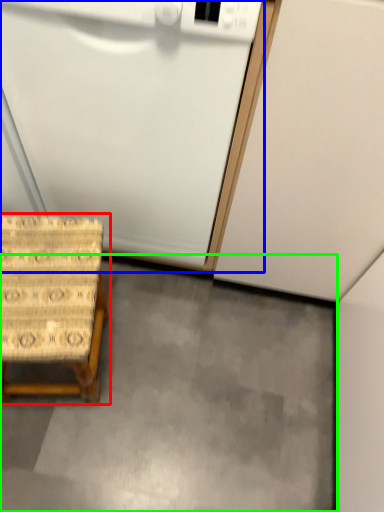
Question: Considering the real-world distances, which object is closest to furniture (highlighted by a red box)? appliance (highlighted by a blue box) or concrete (highlighted by a green box).

Choices:
 (A) appliance
 (B) concrete

Answer: (A)